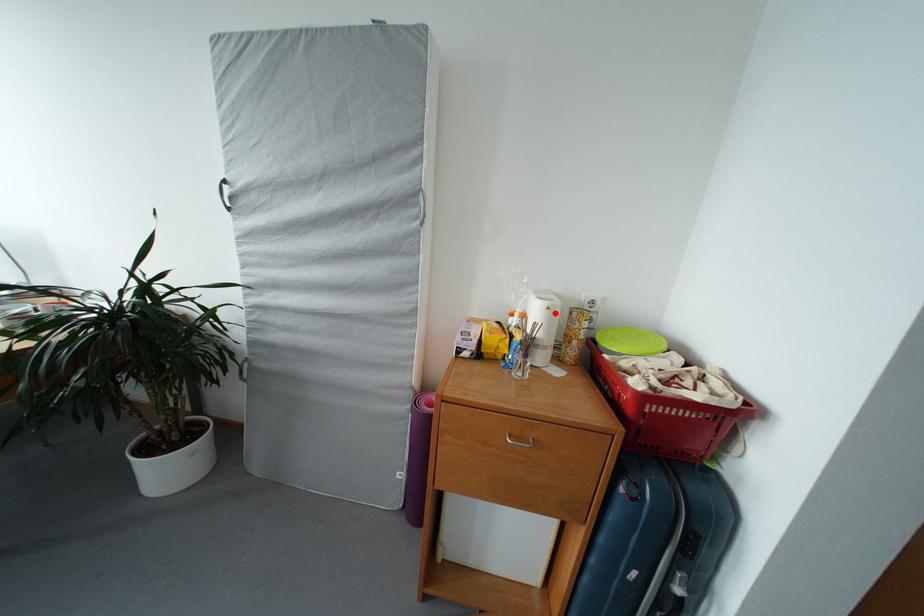
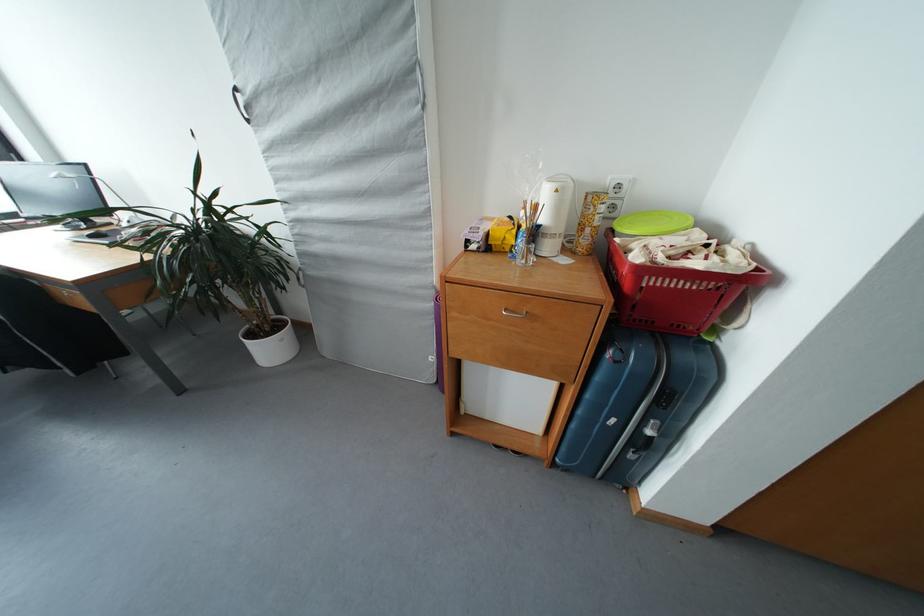
Where in the second image is the point corresponding to the highlighted location from the first image?

(563, 196)